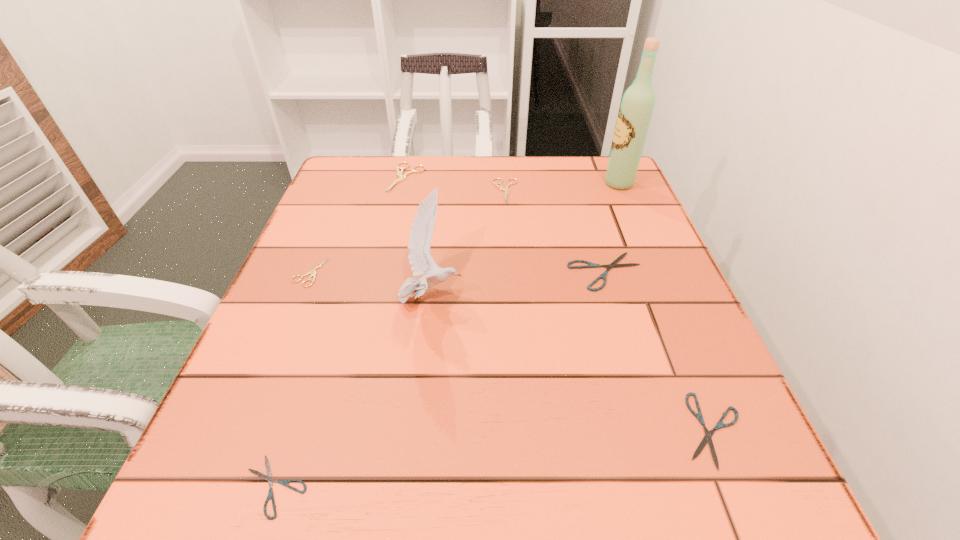
Locate an element on the screen. The height and width of the screenshot is (540, 960). empty location between the biggest black shears and the second beige shears from right to left is located at coordinates (506, 225).

In order to click on free area in between the second biggest black shears and the fifth object from left to right in this screenshot , I will do `click(609, 310)`.

Identify the location of free space between the second beige shears from left to right and the white wine bottle. (513, 180).

The height and width of the screenshot is (540, 960). I want to click on empty location between the leftmost beige shears and the white wine bottle, so click(465, 228).

Identify the location of unoccupied position between the shortest object and the biggest black shears. The width and height of the screenshot is (960, 540). (440, 379).

At what (x,y) coordinates should I click in order to perform the action: click on empty space that is in between the wine bottle and the second beige shears from right to left. Please return your answer as a coordinate pair (x, y). This screenshot has height=540, width=960. Looking at the image, I should click on (513, 180).

Locate which object ranks sixth in proximity to the tallest object. Please provide its 2D coordinates. Your answer should be formatted as a tuple, i.e. [(x, y)], where the tuple contains the x and y coordinates of a point satisfying the conditions above.

[(313, 272)]

Locate an element on the screen. object that stands as the fourth closest to the leftmost black shears is located at coordinates (707, 438).

This screenshot has width=960, height=540. In order to click on the fourth closest shears to the smallest black shears in this screenshot , I will do click(399, 173).

The image size is (960, 540). In order to click on shears that is the fourth closest to the tallest object in this screenshot , I will do `click(707, 438)`.